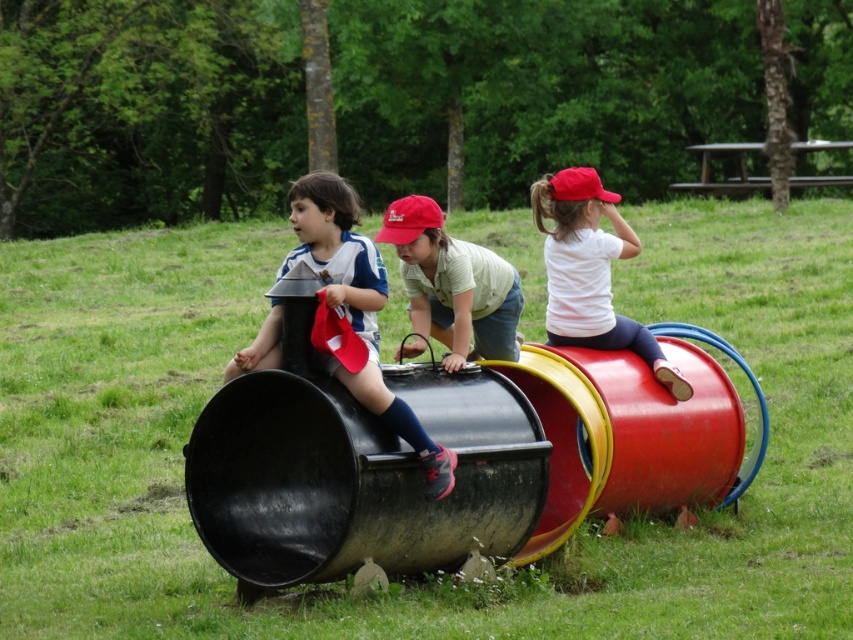
Does white matte shirt at upper right have a lesser width compared to matte red cap at center?

Incorrect, white matte shirt at upper right's width is not less than matte red cap at center's.

Which is behind, point (558, 202) or point (506, 337)?

Positioned behind is point (558, 202).

Identify the location of white matte shirt at upper right. Image resolution: width=853 pixels, height=640 pixels. pos(590,272).

Consider the image. Does matte black pants at left appear on the right side of matte red cap at center?

In fact, matte black pants at left is to the left of matte red cap at center.

Measure the distance between point (328, 221) and camera.

They are 39.78 feet apart.

This screenshot has height=640, width=853. I want to click on matte black pants at left, so click(357, 308).

Image resolution: width=853 pixels, height=640 pixels. Identify the location of matte black pants at left. (357, 308).

Between matte black pants at left and white matte shirt at upper right, which one is positioned lower?

matte black pants at left is below.

Is matte black pants at left bigger than white matte shirt at upper right?

No.

Find the location of a particular element. matte black pants at left is located at coordinates (357, 308).